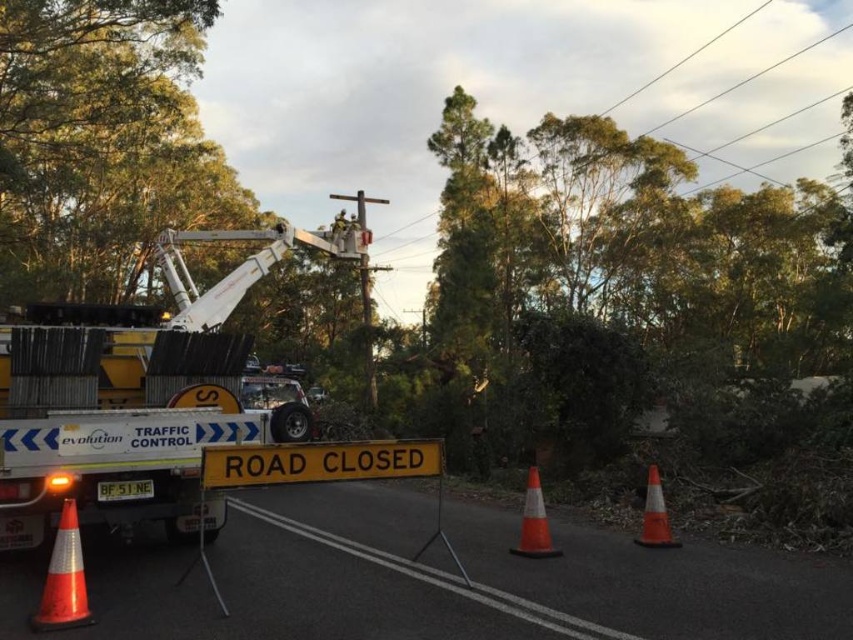
Question: Which point is farther from the camera taking this photo?

Choices:
 (A) (538, 548)
 (B) (53, 556)
 (C) (267, 426)
 (D) (654, 520)

Answer: (D)

Question: Is orange reflective cone at lower left further to the viewer compared to orange reflective cone at right?

Choices:
 (A) yes
 (B) no

Answer: (B)

Question: Which object is positioned farthest from the orange reflective cone at right?

Choices:
 (A) orange reflective cone at center
 (B) orange reflective cone at lower left

Answer: (B)

Question: Among these points, which one is nearest to the camera?

Choices:
 (A) (68, 561)
 (B) (370, 237)
 (C) (529, 531)

Answer: (A)

Question: Is white metallic tow truck at center closer to the viewer compared to orange reflective cone at right?

Choices:
 (A) no
 (B) yes

Answer: (B)

Question: Is white metallic tow truck at center in front of orange reflective cone at right?

Choices:
 (A) yes
 (B) no

Answer: (A)